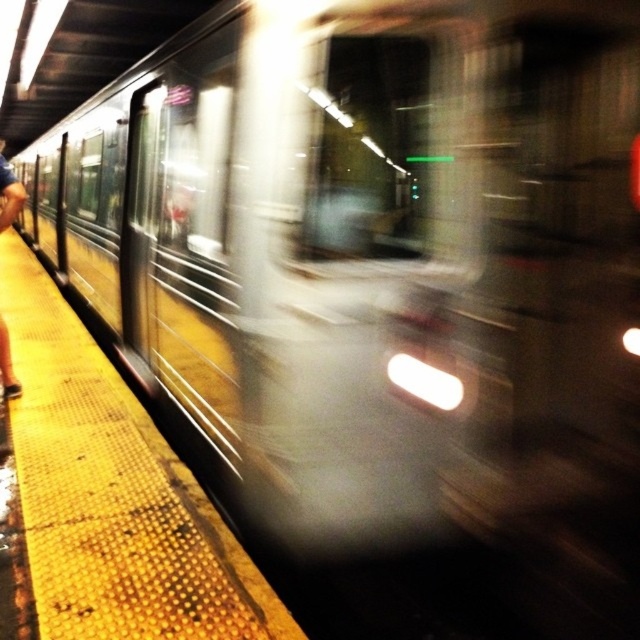
Between yellow textured platform at left and blue jeans at left, which one has less height?

With less height is yellow textured platform at left.

Who is more forward, (156, 481) or (4, 372)?

Point (156, 481) is in front.

This screenshot has height=640, width=640. In order to click on yellow textured platform at left in this screenshot , I will do `click(113, 493)`.